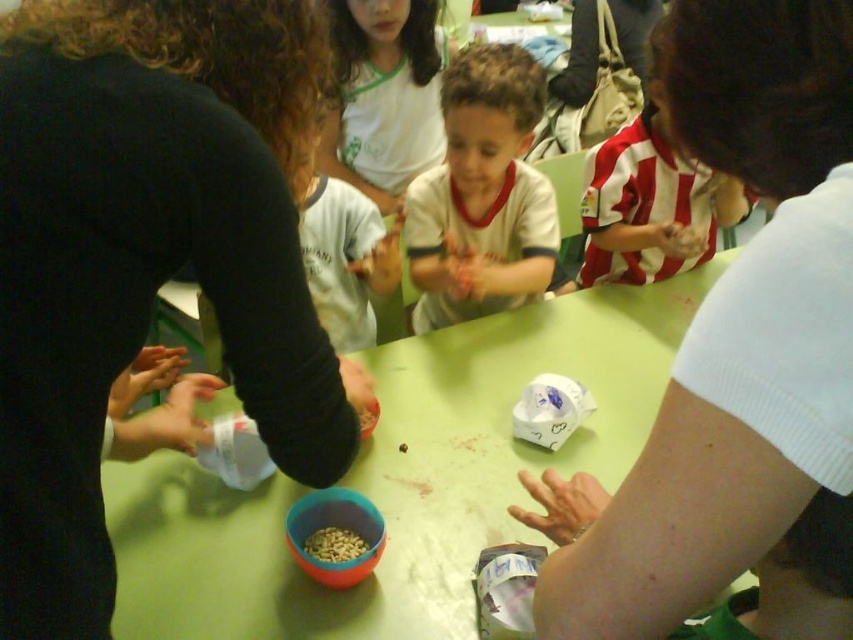
Between black matte shirt at left and green matte table at center, which one appears on the right side from the viewer's perspective?

green matte table at center is more to the right.

Is black matte shirt at left bigger than green matte table at center?

No, black matte shirt at left is not bigger than green matte table at center.

The width and height of the screenshot is (853, 640). Identify the location of black matte shirt at left. pyautogui.click(x=148, y=259).

Between black matte shirt at left and striped jersey at center, which one is positioned higher?

striped jersey at center

The width and height of the screenshot is (853, 640). I want to click on black matte shirt at left, so click(x=148, y=259).

Where is `black matte shirt at left`? black matte shirt at left is located at coordinates (148, 259).

Does green matte table at center lie behind striped jersey at center?

Yes, it is behind striped jersey at center.

Is green matte table at center shorter than striped jersey at center?

Incorrect, green matte table at center's height does not fall short of striped jersey at center's.

You are a GUI agent. You are given a task and a screenshot of the screen. Output one action in this format:
    pyautogui.click(x=<x>, y=<y>)
    Task: Click on the green matte table at center
    The image size is (853, 640).
    Given the screenshot: What is the action you would take?
    pyautogui.click(x=402, y=477)